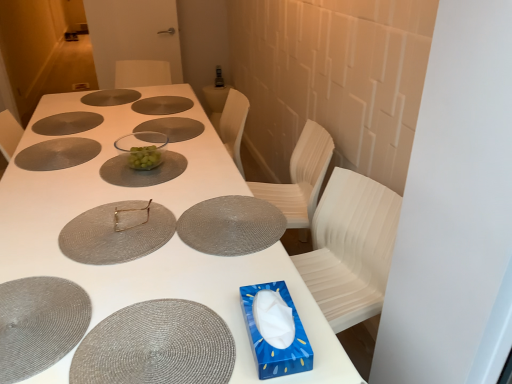
I want to click on free area in between transparent glass bowl at center, acting as the 6th glass plate starting from the front, and blue paper tissue box at lower right, so click(200, 200).